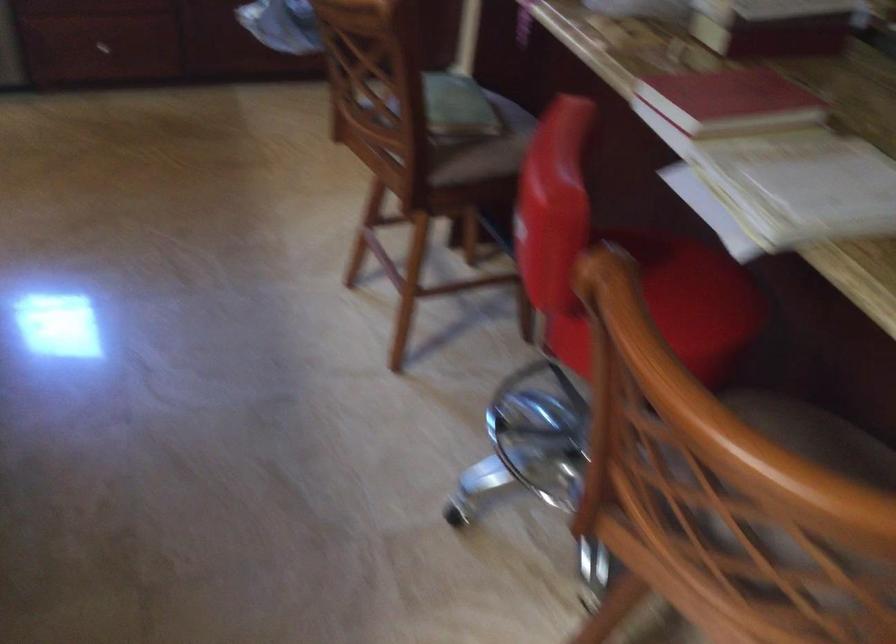
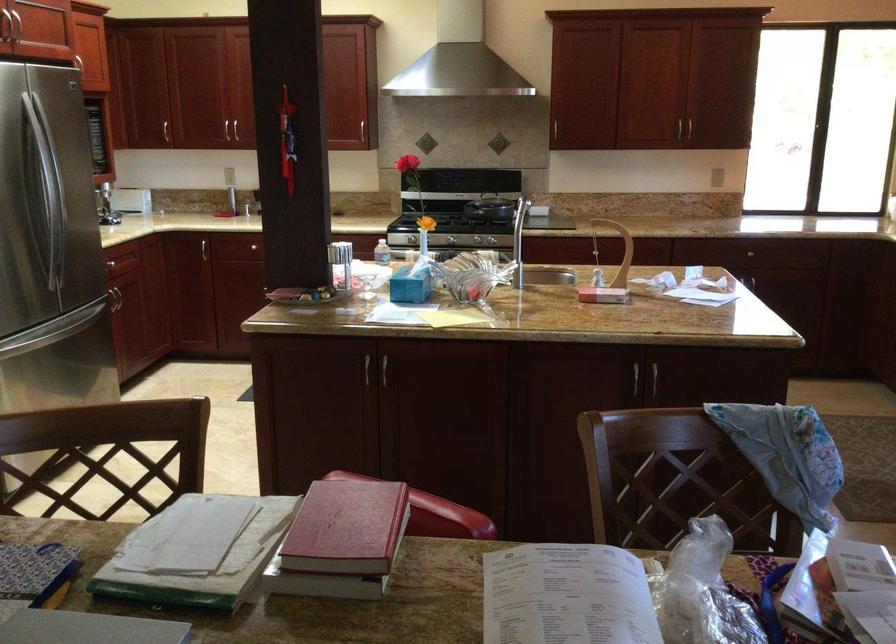
Find the pixel in the second image that matches point 735,82 in the first image.

(346, 527)